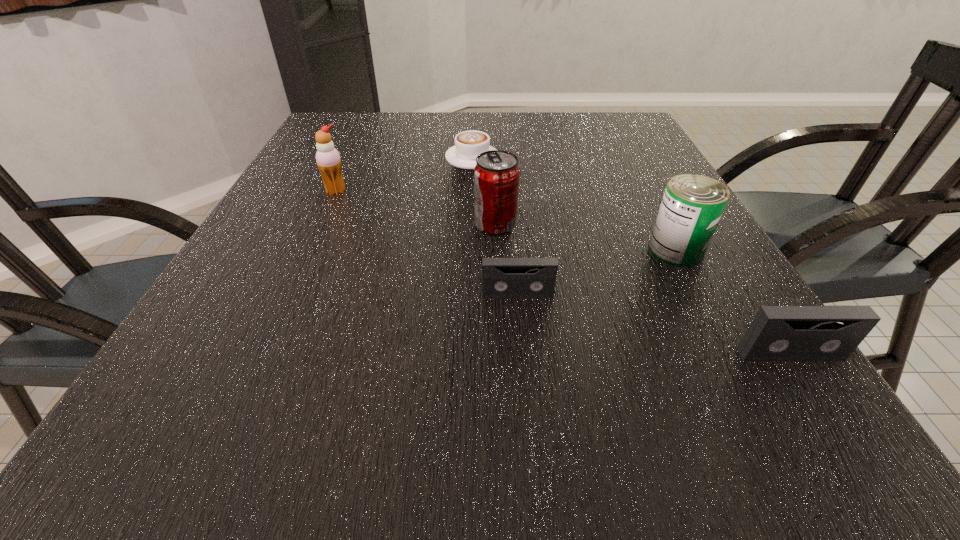
Image resolution: width=960 pixels, height=540 pixels. What are the coordinates of `object that can be found as the fifth closest to the shortest object` in the screenshot? It's located at (777, 333).

Where is `vacant space that satisfies the following two spatial constraints: 1. at the front with a straw on the leftmost object; 2. on the right side of the pop soda`? Image resolution: width=960 pixels, height=540 pixels. vacant space that satisfies the following two spatial constraints: 1. at the front with a straw on the leftmost object; 2. on the right side of the pop soda is located at coordinates (321, 225).

In order to click on free space that satisfies the following two spatial constraints: 1. at the front with a straw on the leftmost object; 2. on the right side of the pop soda in this screenshot , I will do `click(321, 225)`.

Find the location of a particular element. vacant space that satisfies the following two spatial constraints: 1. at the front with a straw on the second farthest object; 2. on the left side of the can is located at coordinates (309, 250).